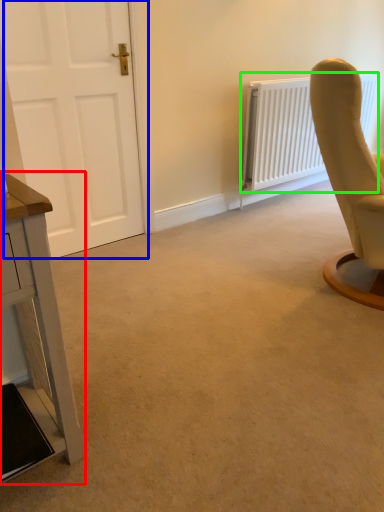
Question: Which is farther away from table (highlighted by a red box)? door (highlighted by a blue box) or radiator (highlighted by a green box)?

Choices:
 (A) door
 (B) radiator

Answer: (B)